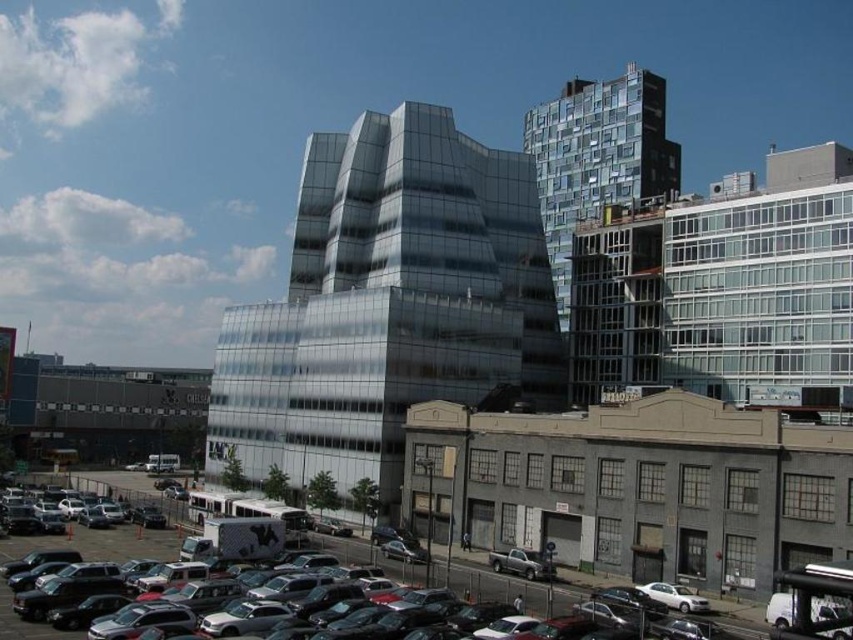
You are a delivery person trying to park your 4.5 meter long truck in the parking lot. You see the gray concrete building at lower center and the shiny black sedan at lower left. Is there enough space between them to park your truck?

The distance between the gray concrete building at lower center and the shiny black sedan at lower left is 10.39 meters. Since your truck is 4.5 meters long, there is sufficient space between them to park your truck.

You are standing at point (503, 588) in the urban scene. What object is located exactly at this point?

The shiny black sedan at lower left is located exactly at point (503, 588).

You are standing in the parking lot of the urban scene. There are two points marked in the image. The first point is at coordinates point (10, 547), and the second is at point (136, 512). Which point is closer to you?

Point (10, 547) is closer to the viewer than point (136, 512).